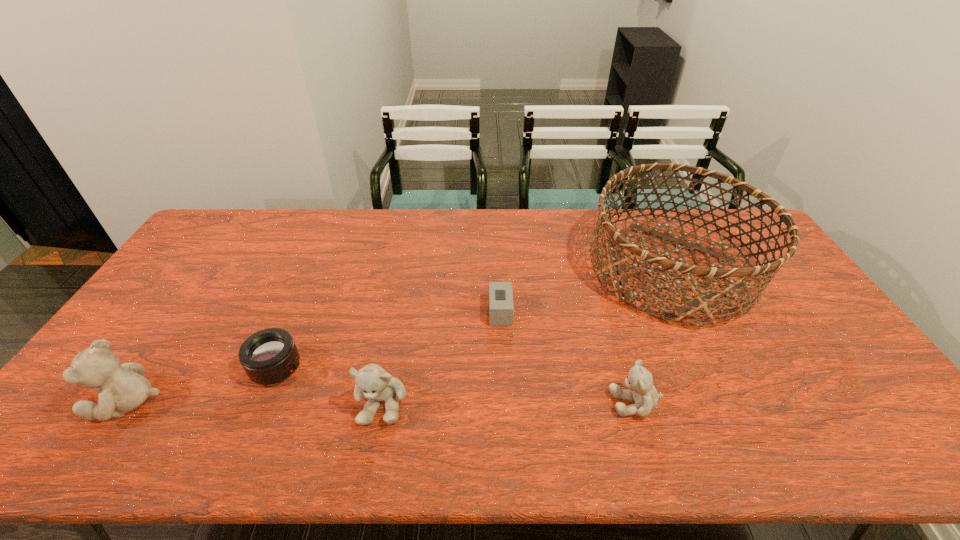
Locate which object is the third closest to the third tallest object. Please provide its 2D coordinates. Your answer should be formatted as a tuple, i.e. [(x, y)], where the tuple contains the x and y coordinates of a point satisfying the conditions above.

[(122, 388)]

Where is `teddy bear that stands as the second closest to the third tallest object`? teddy bear that stands as the second closest to the third tallest object is located at coordinates pos(641,390).

Identify the location of the second closest teddy bear to the second object from left to right. The height and width of the screenshot is (540, 960). (122, 388).

Where is `free region that satisfies the following two spatial constraints: 1. on the front-facing side of the alarm clock; 2. on the face of the third object from left to right`? free region that satisfies the following two spatial constraints: 1. on the front-facing side of the alarm clock; 2. on the face of the third object from left to right is located at coordinates (505, 402).

This screenshot has width=960, height=540. Identify the location of vacant space that satisfies the following two spatial constraints: 1. on the front-facing side of the shortest object; 2. on the face of the third tallest object. click(x=505, y=402).

You are a GUI agent. You are given a task and a screenshot of the screen. Output one action in this format:
    pyautogui.click(x=<x>, y=<y>)
    Task: Click on the vacant area in the image that satisfies the following two spatial constraints: 1. on the front-facing side of the shortest object; 2. on the face of the fourth object from right to left
    
    Given the screenshot: What is the action you would take?
    pyautogui.click(x=505, y=402)